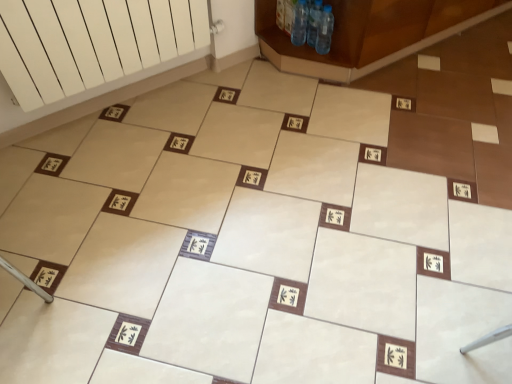
Question: Can you confirm if transparent plastic bottles at upper center, which is the 3th bottle in right-to-left order, is smaller than brown wooden cabinet at upper right?

Choices:
 (A) yes
 (B) no

Answer: (A)

Question: Can you confirm if transparent plastic bottles at upper center, which is the 3th bottle in right-to-left order, is bigger than brown wooden cabinet at upper right?

Choices:
 (A) no
 (B) yes

Answer: (A)

Question: Is transparent plastic bottles at upper center, which is the 3th bottle in right-to-left order, shorter than brown wooden cabinet at upper right?

Choices:
 (A) no
 (B) yes

Answer: (B)

Question: Does transparent plastic bottles at upper center, which is counted as the 1th bottle, starting from the left, have a lesser width compared to brown wooden cabinet at upper right?

Choices:
 (A) yes
 (B) no

Answer: (A)

Question: Can you confirm if transparent plastic bottles at upper center, which is counted as the 1th bottle, starting from the left, is wider than brown wooden cabinet at upper right?

Choices:
 (A) yes
 (B) no

Answer: (B)

Question: Can brown wooden cabinet at upper right be found inside transparent plastic bottles at upper center, which is the 3th bottle in right-to-left order?

Choices:
 (A) yes
 (B) no

Answer: (B)

Question: Is brown wooden cabinet at upper right not within transparent plastic bottles at upper center, which is the 3th bottle in right-to-left order?

Choices:
 (A) no
 (B) yes

Answer: (B)

Question: From a real-world perspective, is brown wooden cabinet at upper right located higher than transparent plastic bottles at upper center, which is the 3th bottle in right-to-left order?

Choices:
 (A) no
 (B) yes

Answer: (B)

Question: Does brown wooden cabinet at upper right have a lesser width compared to transparent plastic bottles at upper center, which is the 3th bottle in right-to-left order?

Choices:
 (A) no
 (B) yes

Answer: (A)

Question: Is brown wooden cabinet at upper right positioned with its back to transparent plastic bottles at upper center, which is counted as the 1th bottle, starting from the left?

Choices:
 (A) no
 (B) yes

Answer: (A)

Question: Does brown wooden cabinet at upper right have a larger size compared to transparent plastic bottles at upper center, which is the 3th bottle in right-to-left order?

Choices:
 (A) no
 (B) yes

Answer: (B)

Question: From a real-world perspective, is brown wooden cabinet at upper right under transparent plastic bottles at upper center, which is the 3th bottle in right-to-left order?

Choices:
 (A) no
 (B) yes

Answer: (A)

Question: Could you tell me if clear plastic bottle at upper center, which appears as the second bottle when viewed from the left, is facing brown wooden cabinet at upper right?

Choices:
 (A) yes
 (B) no

Answer: (A)